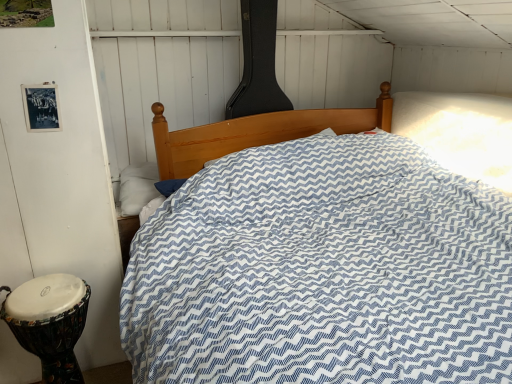
Find the location of `empty space that is ontop of white leather drum at lower left (from a real-world perspective)`. empty space that is ontop of white leather drum at lower left (from a real-world perspective) is located at coordinates pos(50,285).